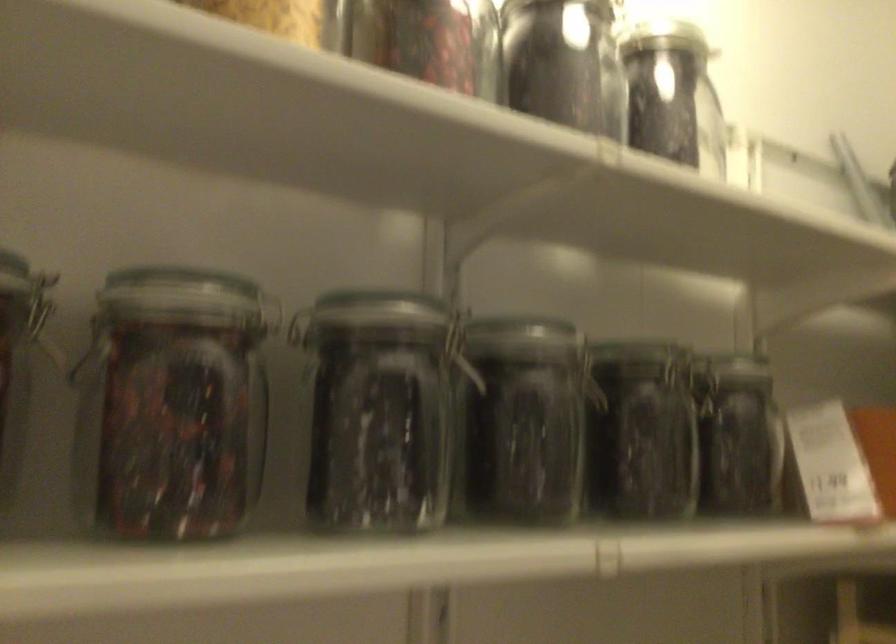
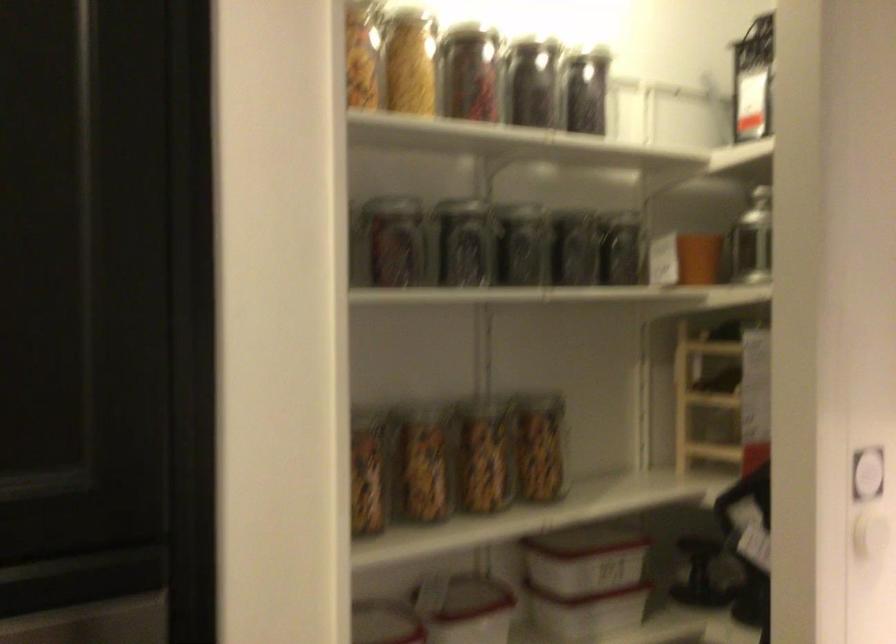
Locate, in the second image, the point that corresponds to point 728,431 in the first image.

(622, 249)